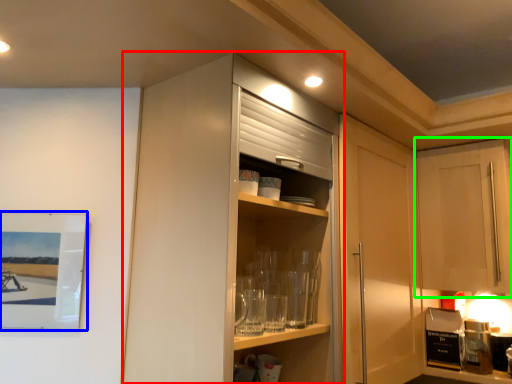
Question: Based on their relative distances, which object is farther from cabinetry (highlighted by a red box)? Choose from picture frame (highlighted by a blue box) and cabinetry (highlighted by a green box).

Choices:
 (A) picture frame
 (B) cabinetry

Answer: (B)